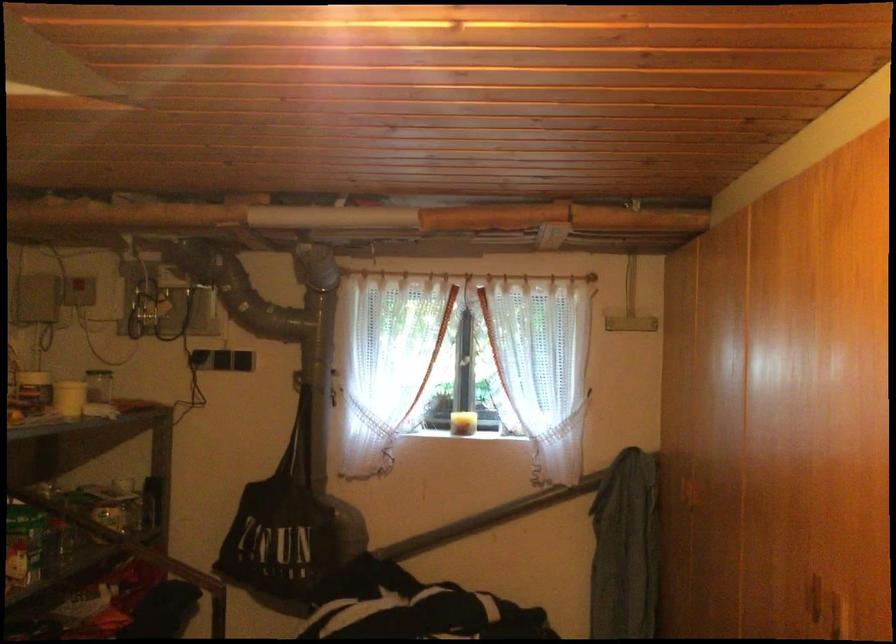
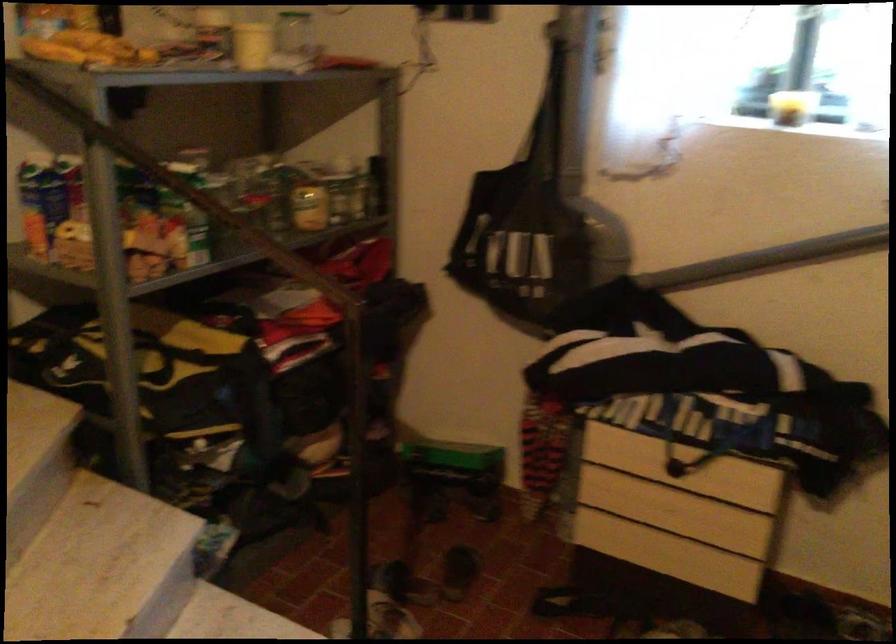
Based on the continuous images, in which direction is the camera rotating?

The rotation direction of the camera is left-down.